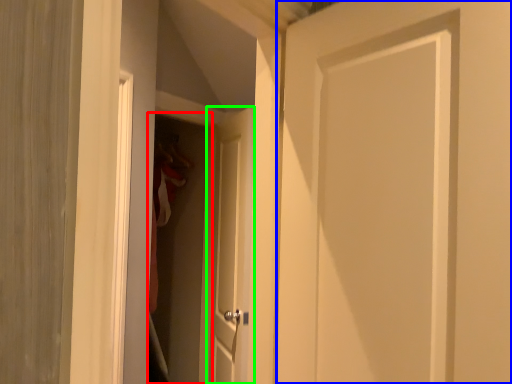
Question: Which object is the closest to the screen door (highlighted by a red box)? Choose among these: door (highlighted by a blue box) or door (highlighted by a green box).

Choices:
 (A) door
 (B) door

Answer: (B)